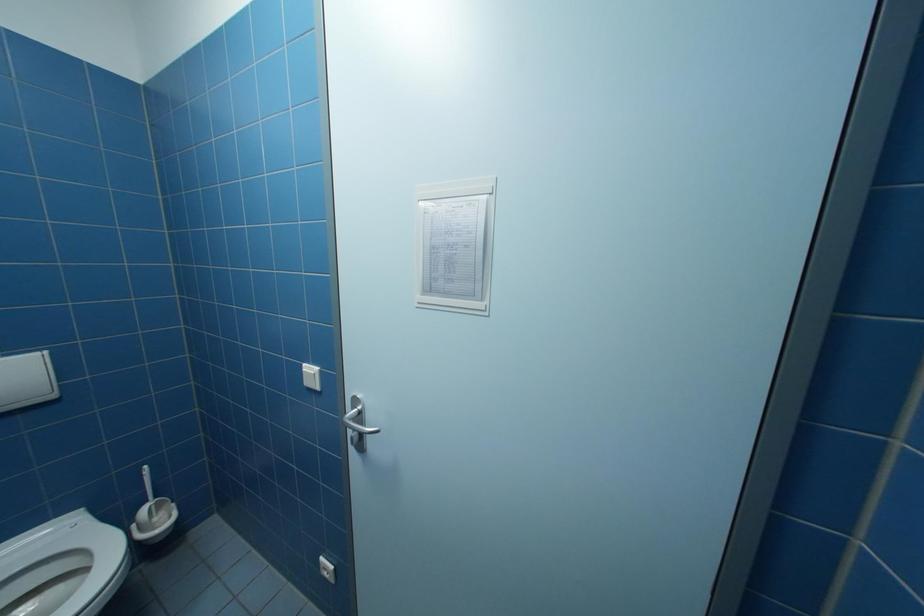
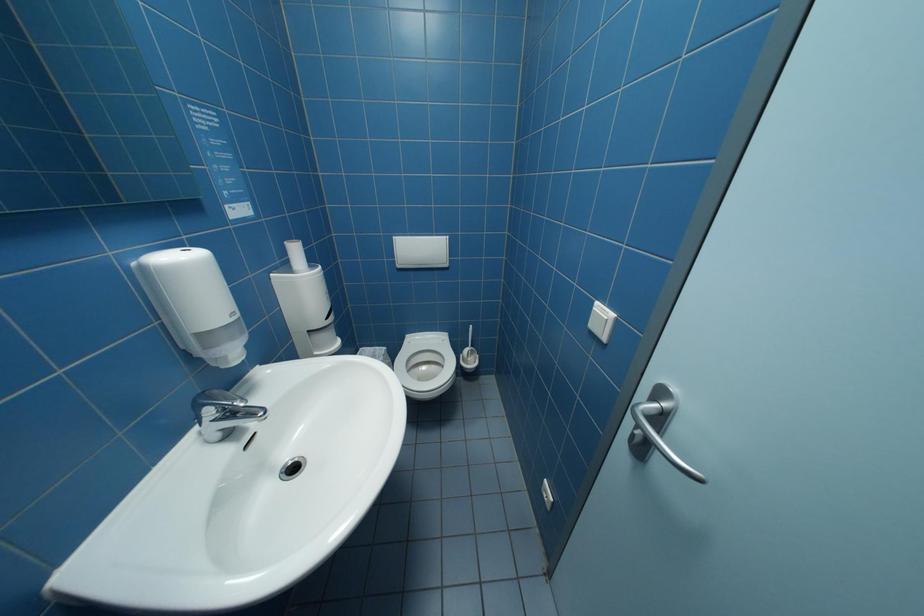
The first image is from the beginning of the video and the second image is from the end. How did the camera likely rotate when shooting the video?

The rotation direction of the camera is left-down.